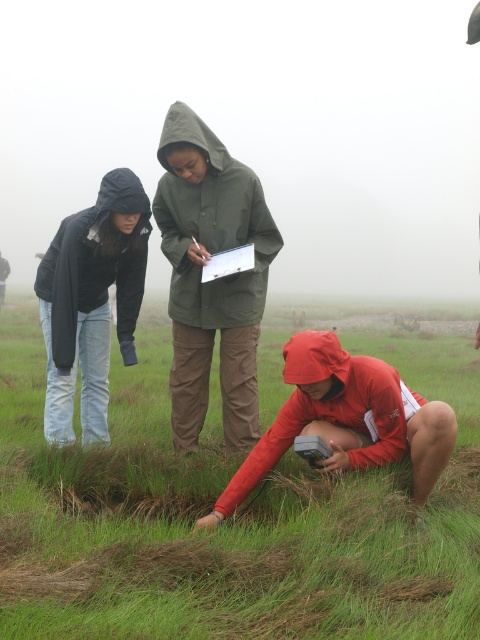
Question: Does green grassy at center appear on the left side of green matte raincoat at center?

Choices:
 (A) yes
 (B) no

Answer: (A)

Question: Does green grassy at center appear on the left side of red matte jacket at lower right?

Choices:
 (A) no
 (B) yes

Answer: (B)

Question: Is green grassy at center thinner than matte black jacket at left?

Choices:
 (A) yes
 (B) no

Answer: (B)

Question: Estimate the real-world distances between objects in this image. Which object is farther from the matte black jacket at left?

Choices:
 (A) green matte raincoat at center
 (B) red matte jacket at lower right

Answer: (B)

Question: Estimate the real-world distances between objects in this image. Which object is closer to the green matte raincoat at center?

Choices:
 (A) green grassy at center
 (B) matte black jacket at left

Answer: (B)

Question: Estimate the real-world distances between objects in this image. Which object is closer to the green matte raincoat at center?

Choices:
 (A) matte black jacket at left
 (B) red matte jacket at lower right
 (C) green grassy at center

Answer: (A)